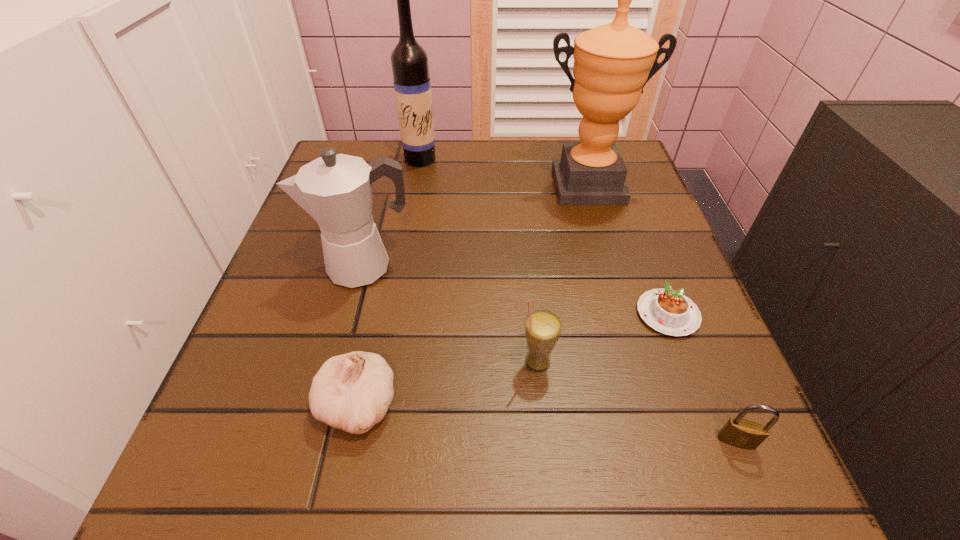
Where is `coffeepot at the left edge`? coffeepot at the left edge is located at coordinates (336, 190).

This screenshot has width=960, height=540. I want to click on garlic located in the left edge section of the desktop, so tap(352, 392).

You are a GUI agent. You are given a task and a screenshot of the screen. Output one action in this format:
    pyautogui.click(x=<x>, y=<y>)
    Task: Click on the award present at the right edge
    This screenshot has height=540, width=960.
    Given the screenshot: What is the action you would take?
    pyautogui.click(x=612, y=63)

Locate an element on the screen. padlock at the right edge is located at coordinates (737, 432).

This screenshot has width=960, height=540. I want to click on pudding present at the right edge, so click(x=670, y=312).

Identify the location of object present at the far right corner. (612, 63).

The image size is (960, 540). Identify the location of object present at the near right corner. (737, 432).

At what (x,y) coordinates should I click in order to perform the action: click on vacant space at the far edge. Please return your answer as a coordinate pair (x, y). This screenshot has height=540, width=960. Looking at the image, I should click on (538, 159).

The width and height of the screenshot is (960, 540). In order to click on free spot at the near edge of the desktop in this screenshot , I will do `click(647, 491)`.

Identify the location of free space at the left edge of the desktop. This screenshot has height=540, width=960. (293, 334).